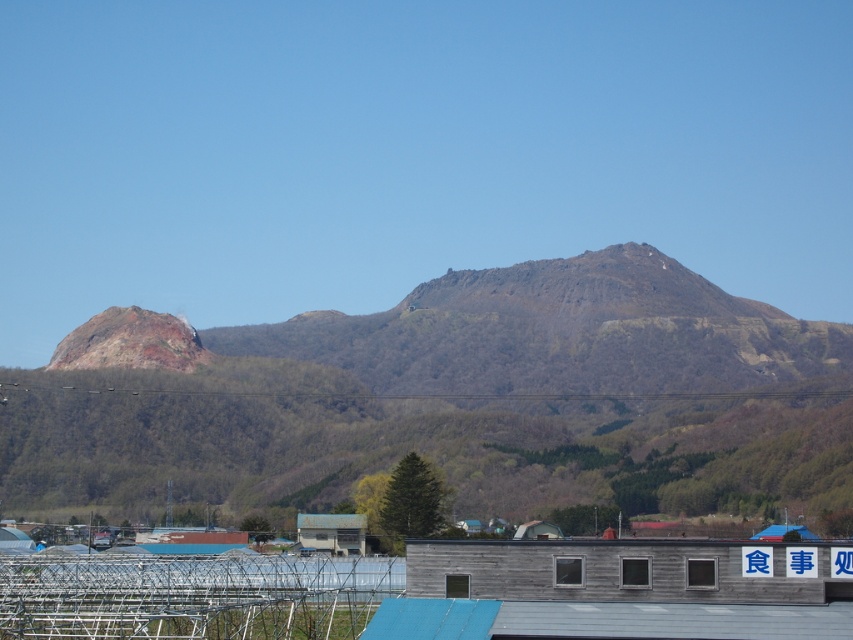
You are a hiker who has just arrived at the rusty metallic rock at left and wants to reach the wooden hut at center. Based on the terrain described, can you estimate how far you need to travel to get there?

The distance between the rusty metallic rock at left and the wooden hut at center is 146.73 meters, so you need to travel approximately 147 meters to reach the wooden hut at center from the rusty metallic rock at left.

You are planning to place a new bench in the scenic landscape. The bench requires a space wider than the wooden hut at center. Can the rusty metallic rock at left provide enough space for the bench?

The rusty metallic rock at left has a width larger than the wooden hut at center, so it can provide enough space for the bench that requires a wider area than the wooden hut at center.

You are standing at the base of the mountain and see the rusty metallic rock at left and the wooden hut at center. Which object is higher up the mountain?

The rusty metallic rock at left is above the wooden hut at center, so it is higher up the mountain.